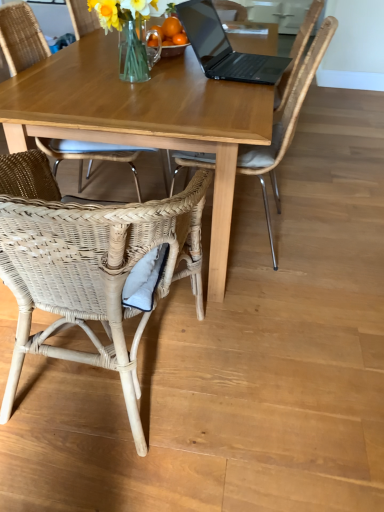
Question: Is woven wicker chair at lower left, the third chair positioned from the right, not within black matte laptop at upper center?

Choices:
 (A) yes
 (B) no

Answer: (A)

Question: Considering the relative sizes of woven wicker chair at lower left, the third chair positioned from the right, and black matte laptop at upper center in the image provided, is woven wicker chair at lower left, the third chair positioned from the right, thinner than black matte laptop at upper center?

Choices:
 (A) no
 (B) yes

Answer: (A)

Question: Is woven wicker chair at lower left, the first chair in the left-to-right sequence, turned away from black matte laptop at upper center?

Choices:
 (A) no
 (B) yes

Answer: (A)

Question: From the image's perspective, does woven wicker chair at lower left, the first chair in the left-to-right sequence, appear higher than black matte laptop at upper center?

Choices:
 (A) yes
 (B) no

Answer: (B)

Question: Is the depth of woven wicker chair at lower left, the first chair in the left-to-right sequence, greater than that of black matte laptop at upper center?

Choices:
 (A) no
 (B) yes

Answer: (A)

Question: Considering the positions of wooden table at center and woven rattan chair at upper center, positioned as the third chair in left-to-right order, in the image, is wooden table at center wider or thinner than woven rattan chair at upper center, positioned as the third chair in left-to-right order,?

Choices:
 (A) wide
 (B) thin

Answer: (A)

Question: Considering the positions of wooden table at center and woven rattan chair at upper center, the first chair when ordered from right to left, in the image, is wooden table at center bigger or smaller than woven rattan chair at upper center, the first chair when ordered from right to left,?

Choices:
 (A) big
 (B) small

Answer: (A)

Question: Is wooden table at center taller or shorter than woven rattan chair at upper center, the first chair when ordered from right to left?

Choices:
 (A) tall
 (B) short

Answer: (B)

Question: Do you think wooden table at center is within woven rattan chair at upper center, the first chair when ordered from right to left, or outside of it?

Choices:
 (A) outside
 (B) inside

Answer: (A)

Question: From their relative heights in the image, would you say woven rattan chair at lower left, arranged as the second chair when viewed from the right, is taller or shorter than translucent glass vase at upper center?

Choices:
 (A) short
 (B) tall

Answer: (B)

Question: Would you say woven rattan chair at lower left, arranged as the second chair when viewed from the right, is to the left or to the right of translucent glass vase at upper center in the picture?

Choices:
 (A) left
 (B) right

Answer: (A)

Question: From the image's perspective, is woven rattan chair at lower left, which is the 2th chair in left-to-right order, positioned above or below translucent glass vase at upper center?

Choices:
 (A) above
 (B) below

Answer: (B)

Question: Considering the positions of woven rattan chair at lower left, arranged as the second chair when viewed from the right, and translucent glass vase at upper center in the image, is woven rattan chair at lower left, arranged as the second chair when viewed from the right, bigger or smaller than translucent glass vase at upper center?

Choices:
 (A) big
 (B) small

Answer: (A)

Question: Is translucent glass vase at upper center bigger or smaller than woven rattan chair at lower left, arranged as the second chair when viewed from the right?

Choices:
 (A) small
 (B) big

Answer: (A)

Question: Considering the positions of point (134, 12) and point (142, 435), is point (134, 12) closer or farther from the camera than point (142, 435)?

Choices:
 (A) closer
 (B) farther

Answer: (B)